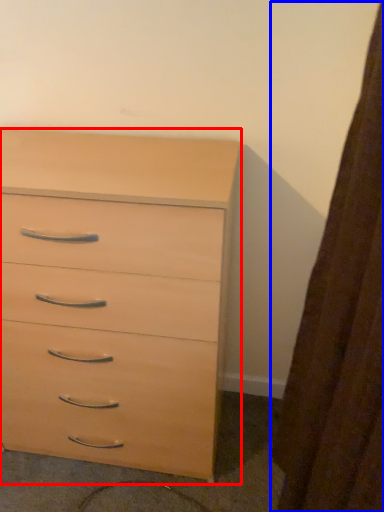
Question: Among these objects, which one is farthest to the camera, chest of drawers (highlighted by a red box) or curtain (highlighted by a blue box)?

Choices:
 (A) chest of drawers
 (B) curtain

Answer: (A)